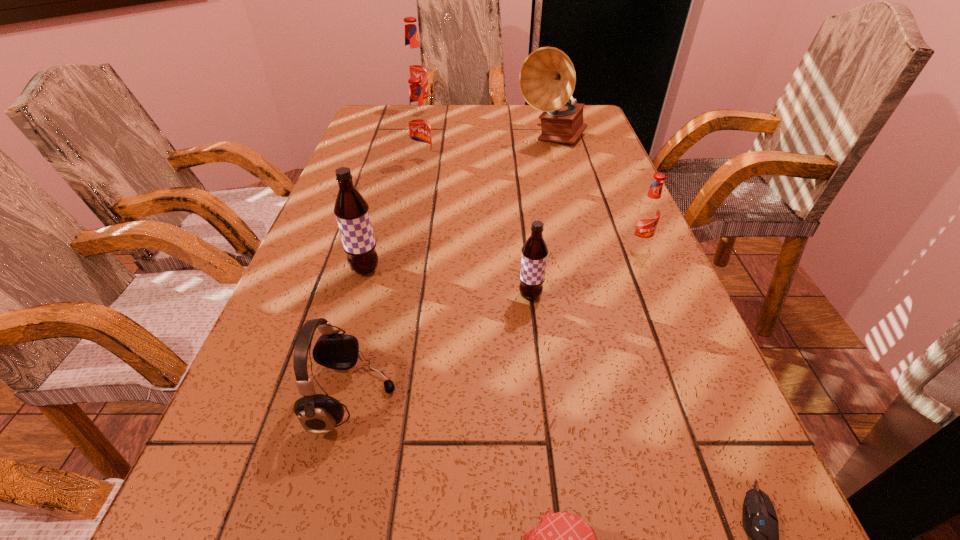
Locate an element on the screen. This screenshot has width=960, height=540. free spot between the phonograph record and the left brown root beer is located at coordinates (459, 205).

This screenshot has height=540, width=960. I want to click on unoccupied area between the fifth nearest object and the smallest red root beer, so click(x=502, y=256).

Image resolution: width=960 pixels, height=540 pixels. I want to click on blank region between the third nearest object and the fourth nearest root beer, so click(x=388, y=280).

I want to click on unoccupied area between the farthest root beer and the nearer brown root beer, so click(x=474, y=204).

Locate an element on the screen. Image resolution: width=960 pixels, height=540 pixels. free spot between the eighth nearest object and the headset is located at coordinates (452, 269).

At what (x,y) coordinates should I click in order to perform the action: click on unoccupied position between the second nearest red root beer and the smallest red root beer. Please return your answer as a coordinate pair (x, y). This screenshot has width=960, height=540. Looking at the image, I should click on (531, 203).

Select which object appears as the second closest to the shortest object. Please provide its 2D coordinates. Your answer should be formatted as a tuple, i.e. [(x, y)], where the tuple contains the x and y coordinates of a point satisfying the conditions above.

[(534, 251)]

Choose which object is the nearest neighbor to the red jam. Please provide its 2D coordinates. Your answer should be formatted as a tuple, i.e. [(x, y)], where the tuple contains the x and y coordinates of a point satisfying the conditions above.

[(760, 522)]

Locate which root beer is the fifth closest to the headset. Please provide its 2D coordinates. Your answer should be formatted as a tuple, i.e. [(x, y)], where the tuple contains the x and y coordinates of a point satisfying the conditions above.

[(414, 65)]

Identify which root beer is the closest to the eighth nearest object. Please provide its 2D coordinates. Your answer should be formatted as a tuple, i.e. [(x, y)], where the tuple contains the x and y coordinates of a point satisfying the conditions above.

[(418, 123)]